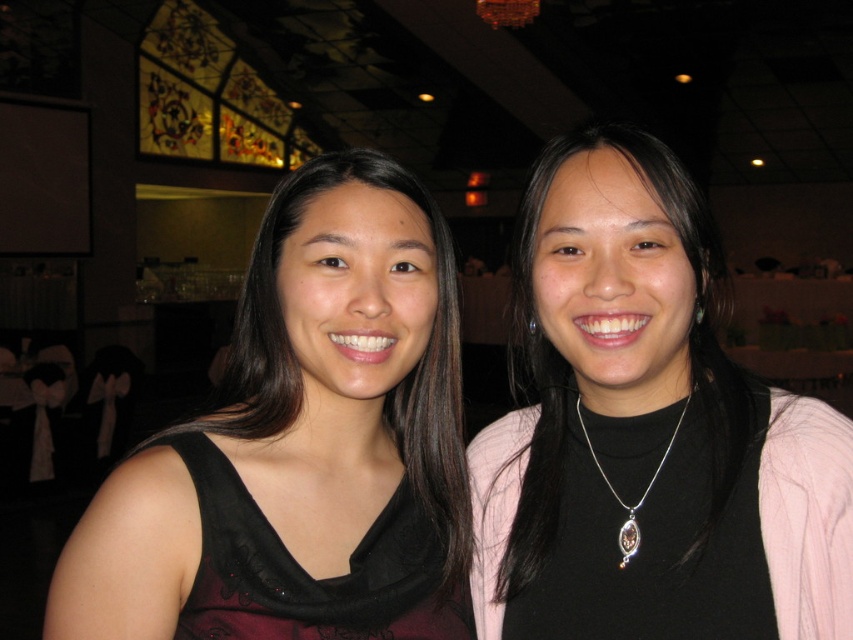
Question: Does black matte necklace at center appear under black matte dress at left?

Choices:
 (A) yes
 (B) no

Answer: (B)

Question: Which is farther from the black matte necklace at center?

Choices:
 (A) black matte dress at left
 (B) silver/glass pendant at center

Answer: (A)

Question: Which of the following is the farthest from the observer?

Choices:
 (A) (596, 628)
 (B) (688, 394)
 (C) (379, 468)

Answer: (C)

Question: Which object appears farthest from the camera in this image?

Choices:
 (A) black matte dress at left
 (B) black matte necklace at center

Answer: (B)

Question: Is black matte dress at left below silver/glass pendant at center?

Choices:
 (A) no
 (B) yes

Answer: (A)

Question: Does black matte necklace at center appear under black matte dress at left?

Choices:
 (A) yes
 (B) no

Answer: (B)